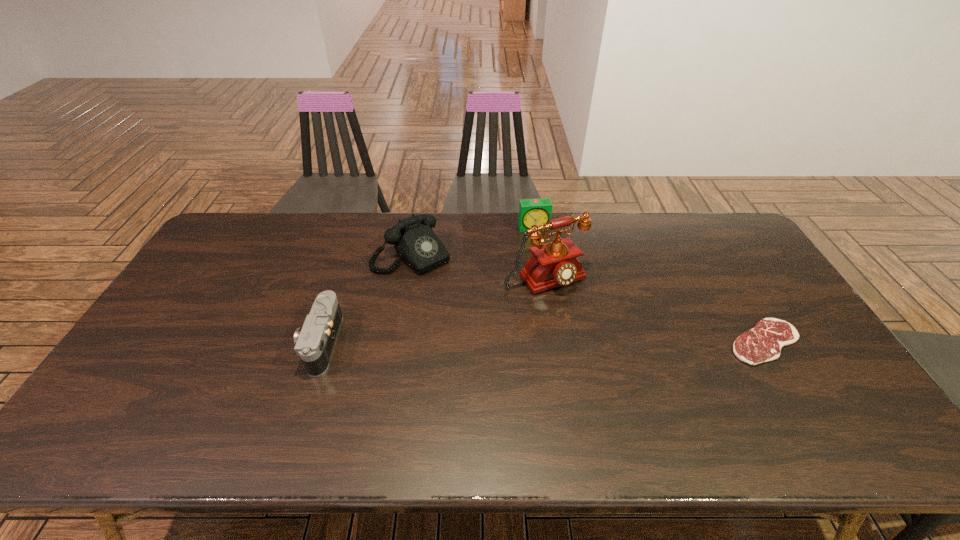
The height and width of the screenshot is (540, 960). I want to click on vacant region located on the dial of the tallest object, so click(641, 396).

This screenshot has width=960, height=540. I want to click on telephone present at the far edge, so click(x=415, y=242).

The width and height of the screenshot is (960, 540). I want to click on alarm clock that is at the far edge, so click(531, 211).

Identify the location of object situated at the right edge. (763, 343).

This screenshot has width=960, height=540. In order to click on vacant space at the far edge in this screenshot , I will do `click(674, 217)`.

You are a GUI agent. You are given a task and a screenshot of the screen. Output one action in this format:
    pyautogui.click(x=<x>, y=<y>)
    Task: Click on the blank space at the near edge of the desktop
    This screenshot has width=960, height=540.
    Given the screenshot: What is the action you would take?
    pyautogui.click(x=198, y=392)

At what (x,y) coordinates should I click in order to perform the action: click on blank space at the right edge. Please return your answer as a coordinate pair (x, y). The height and width of the screenshot is (540, 960). Looking at the image, I should click on (778, 319).

At what (x,y) coordinates should I click in order to perform the action: click on blank area at the far left corner. Please return your answer as a coordinate pair (x, y). Image resolution: width=960 pixels, height=540 pixels. Looking at the image, I should click on (247, 212).

At what (x,y) coordinates should I click in order to perform the action: click on free space between the fourth object from right to left and the farthest object. Please return your answer as a coordinate pair (x, y). Looking at the image, I should click on (473, 241).

Identify the location of empty space that is in between the alarm clock and the leftmost object. (428, 285).